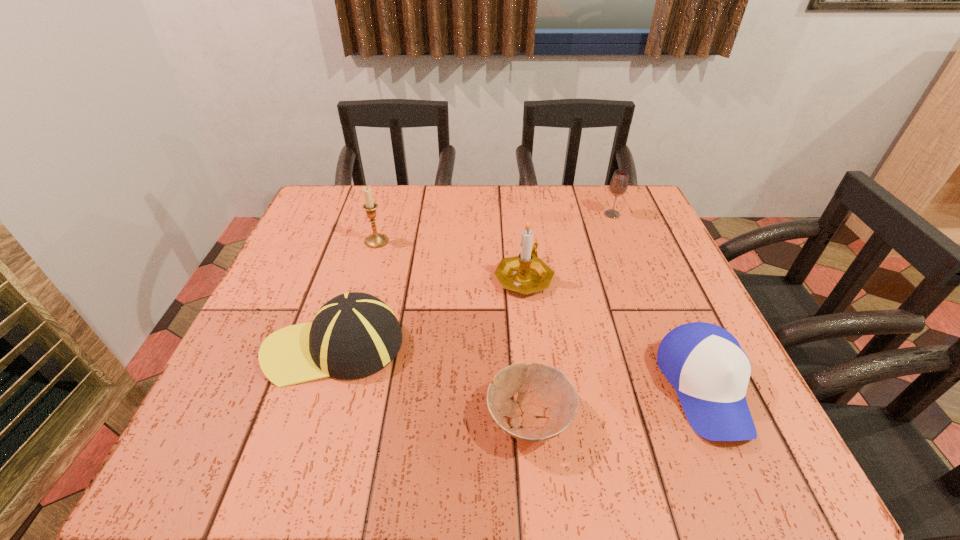
What are the coordinates of `blank space located 0.060m on the front of the farther candle holder` in the screenshot? It's located at (370, 265).

The image size is (960, 540). I want to click on vacant area situated 0.260m on the front of the glass drink container, so click(x=640, y=287).

The image size is (960, 540). I want to click on free space located on the back of the bowl, so click(x=516, y=272).

You are a GUI agent. You are given a task and a screenshot of the screen. Output one action in this format:
    pyautogui.click(x=<x>, y=<y>)
    Task: Click on the candle holder that is at the far edge
    Image resolution: width=960 pixels, height=540 pixels.
    Given the screenshot: What is the action you would take?
    pyautogui.click(x=376, y=240)

Find the location of `glass drink container that is at the far edge`. glass drink container that is at the far edge is located at coordinates [x=618, y=186].

At what (x,y) coordinates should I click in order to perform the action: click on baseball cap that is at the near edge. Please return your answer as a coordinate pair (x, y). Looking at the image, I should click on (710, 372).

This screenshot has width=960, height=540. I want to click on bowl that is at the near edge, so click(549, 408).

This screenshot has width=960, height=540. Identify the location of object that is at the left edge. (354, 335).

Identify the location of glass drink container present at the right edge. This screenshot has width=960, height=540. (618, 186).

At what (x,y) coordinates should I click in order to perform the action: click on baseball cap that is at the right edge. Please return your answer as a coordinate pair (x, y). The height and width of the screenshot is (540, 960). Looking at the image, I should click on (710, 372).